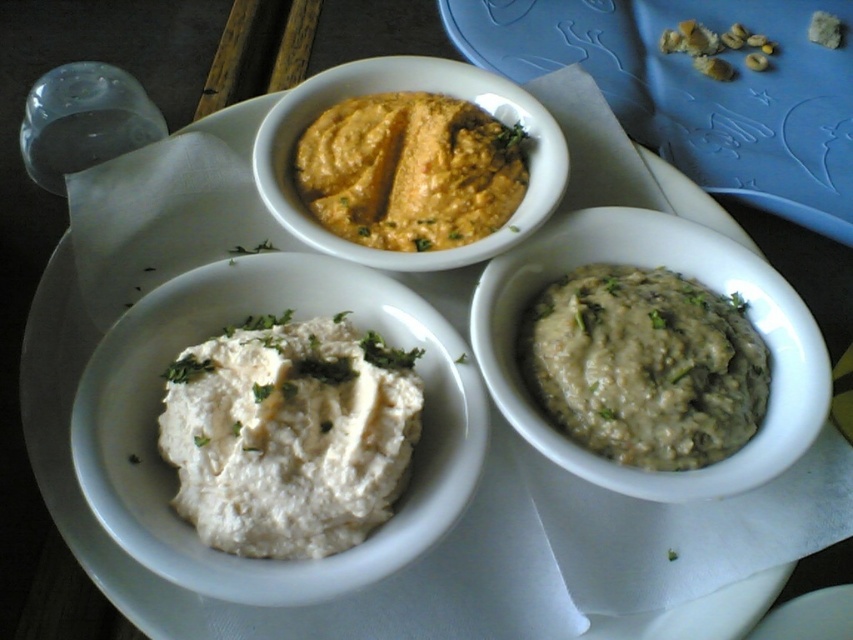
How much distance is there between orange matte hummus at upper center and white creamy paste at bottom right?

orange matte hummus at upper center and white creamy paste at bottom right are 16.09 inches apart.

Between orange matte hummus at upper center and white creamy paste at bottom right, which one appears on the right side from the viewer's perspective?

orange matte hummus at upper center is more to the right.

At what (x,y) coordinates should I click in order to perform the action: click on orange matte hummus at upper center. Please return your answer as a coordinate pair (x, y). The width and height of the screenshot is (853, 640). Looking at the image, I should click on (695, 90).

Is white creamy dip at center taller than white creamy paste at bottom right?

Correct, white creamy dip at center is much taller as white creamy paste at bottom right.

Is white creamy dip at center behind white creamy paste at bottom right?

No, white creamy dip at center is closer to the viewer.

Does point (236, 348) lie behind point (682, 404)?

No, (236, 348) is in front of (682, 404).

At what (x,y) coordinates should I click in order to perform the action: click on white creamy dip at center. Please return your answer as a coordinate pair (x, y). Looking at the image, I should click on click(289, 435).

Is point (283, 502) in front of point (672, 484)?

Yes, it is in front of point (672, 484).

Is point (163, 458) behind point (556, 244)?

No, it is not.

This screenshot has height=640, width=853. What are the coordinates of `white creamy dip at center` in the screenshot? It's located at (289, 435).